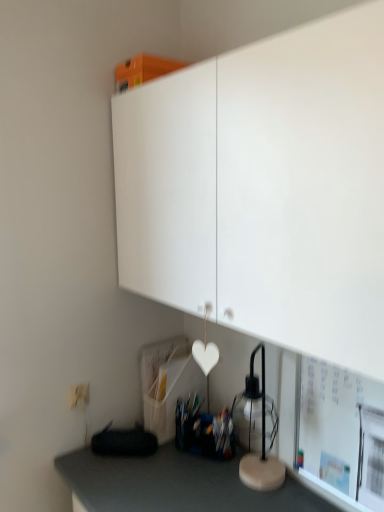
From the picture: Measure the distance between point (280, 469) and camera.

1.42 meters.

At what (x,y) coordinates should I click in order to perform the action: click on white matte cabinet at upper center. Please return your answer as a coordinate pair (x, y). Image resolution: width=384 pixels, height=512 pixels. Looking at the image, I should click on (264, 189).

This screenshot has height=512, width=384. What do you see at coordinates (330, 424) in the screenshot?
I see `white matte bulletin board at lower right` at bounding box center [330, 424].

The height and width of the screenshot is (512, 384). What do you see at coordinates (79, 395) in the screenshot?
I see `white matte electric outlet at lower left` at bounding box center [79, 395].

I want to click on transparent glass table lamp at lower right, so click(262, 450).

How distant is white matte bulletin board at lower right from white matte cabinet at upper center?

white matte bulletin board at lower right and white matte cabinet at upper center are 22.15 inches apart.

Can you confirm if white matte bulletin board at lower right is bigger than white matte cabinet at upper center?

No, white matte bulletin board at lower right is not bigger than white matte cabinet at upper center.

Is white matte bulletin board at lower right wider or thinner than white matte cabinet at upper center?

In the image, white matte bulletin board at lower right appears to be more narrow than white matte cabinet at upper center.

Find the location of `bulletin board behind the white matte cabinet at upper center`. bulletin board behind the white matte cabinet at upper center is located at coordinates (330, 424).

Based on the photo, from a real-world perspective, which object rests below the other?

white matte bulletin board at lower right is physically lower.

Between transparent glass table lamp at lower right and white matte bulletin board at lower right, which one has larger size?

white matte bulletin board at lower right is bigger.

This screenshot has height=512, width=384. Find the location of `bulletin board on the right of white matte electric outlet at lower left`. bulletin board on the right of white matte electric outlet at lower left is located at coordinates (330, 424).

Is white matte bulletin board at lower right facing away from white matte electric outlet at lower left?

No, white matte bulletin board at lower right is not facing the opposite direction of white matte electric outlet at lower left.

Between point (299, 450) and point (82, 395), which one is positioned behind?

The point (82, 395) is more distant.

Considering the sizes of objects white matte bulletin board at lower right and white matte electric outlet at lower left in the image provided, who is smaller, white matte bulletin board at lower right or white matte electric outlet at lower left?

Smaller between the two is white matte electric outlet at lower left.

Is transparent glass table lamp at lower right beside white matte electric outlet at lower left?

transparent glass table lamp at lower right is not next to white matte electric outlet at lower left, and they're not touching.

Considering the positions of point (263, 406) and point (75, 391), is point (263, 406) closer or farther from the camera than point (75, 391)?

Point (263, 406) is closer to the camera than point (75, 391).

Looking at this image, does transparent glass table lamp at lower right turn towards white matte electric outlet at lower left?

No.

Is point (261, 244) behind point (73, 404)?

No, it is not.

Is white matte cabinet at upper center touching white matte electric outlet at lower left?

white matte cabinet at upper center is not next to white matte electric outlet at lower left, and they're not touching.

From a real-world perspective, is white matte cabinet at upper center on white matte electric outlet at lower left?

Indeed, from a real-world perspective, white matte cabinet at upper center stands above white matte electric outlet at lower left.

Where is `electric outlet above the white matte bulletin board at lower right (from the image's perspective)`? electric outlet above the white matte bulletin board at lower right (from the image's perspective) is located at coordinates (79, 395).

Considering the sizes of white matte electric outlet at lower left and white matte bulletin board at lower right in the image, is white matte electric outlet at lower left taller or shorter than white matte bulletin board at lower right?

Considering their sizes, white matte electric outlet at lower left has less height than white matte bulletin board at lower right.

Can you tell me how much white matte electric outlet at lower left and white matte bulletin board at lower right differ in facing direction?

90.6 degrees separate the facing orientations of white matte electric outlet at lower left and white matte bulletin board at lower right.

Between white matte electric outlet at lower left and white matte bulletin board at lower right, which one appears on the left side from the viewer's perspective?

white matte electric outlet at lower left.

Which is more to the right, white matte electric outlet at lower left or white matte cabinet at upper center?

white matte cabinet at upper center.

How many degrees apart are the facing directions of white matte electric outlet at lower left and white matte cabinet at upper center?

89.7 degrees.

Is white matte electric outlet at lower left inside the boundaries of white matte cabinet at upper center, or outside?

white matte electric outlet at lower left is located beyond the bounds of white matte cabinet at upper center.

Who is bigger, white matte electric outlet at lower left or white matte cabinet at upper center?

white matte cabinet at upper center.

This screenshot has width=384, height=512. Find the location of `bulletin board that is under the white matte cabinet at upper center (from a real-world perspective)`. bulletin board that is under the white matte cabinet at upper center (from a real-world perspective) is located at coordinates (330, 424).

The height and width of the screenshot is (512, 384). In the image, there is a transparent glass table lamp at lower right. In order to click on bulletin board below it (from the image's perspective) in this screenshot , I will do `click(330, 424)`.

When comparing their distances from white matte bulletin board at lower right, does white matte electric outlet at lower left or transparent glass table lamp at lower right seem further?

Among the two, white matte electric outlet at lower left is located further to white matte bulletin board at lower right.

Which object lies nearer to the anchor point white matte bulletin board at lower right, transparent glass table lamp at lower right or white matte cabinet at upper center?

transparent glass table lamp at lower right.

Which object lies further to the anchor point transparent glass table lamp at lower right, white matte electric outlet at lower left or white matte cabinet at upper center?

white matte cabinet at upper center is positioned further to the anchor transparent glass table lamp at lower right.

From the image, which object appears to be farther from white matte cabinet at upper center, transparent glass table lamp at lower right or white matte electric outlet at lower left?

Based on the image, white matte electric outlet at lower left appears to be further to white matte cabinet at upper center.

When comparing their distances from white matte bulletin board at lower right, does transparent glass table lamp at lower right or white matte electric outlet at lower left seem further?

white matte electric outlet at lower left is further to white matte bulletin board at lower right.

When comparing their distances from white matte cabinet at upper center, does white matte electric outlet at lower left or white matte bulletin board at lower right seem closer?

Based on the image, white matte bulletin board at lower right appears to be nearer to white matte cabinet at upper center.

Looking at the image, which one is located closer to white matte electric outlet at lower left, white matte cabinet at upper center or transparent glass table lamp at lower right?

Among the two, transparent glass table lamp at lower right is located nearer to white matte electric outlet at lower left.

Which object lies nearer to the anchor point white matte cabinet at upper center, white matte bulletin board at lower right or transparent glass table lamp at lower right?

white matte bulletin board at lower right is closer to white matte cabinet at upper center.

The height and width of the screenshot is (512, 384). Find the location of `table lamp located between white matte electric outlet at lower left and white matte bulletin board at lower right in the left-right direction`. table lamp located between white matte electric outlet at lower left and white matte bulletin board at lower right in the left-right direction is located at coordinates (262, 450).

The image size is (384, 512). I want to click on bulletin board located between white matte cabinet at upper center and white matte electric outlet at lower left in the depth direction, so click(x=330, y=424).

Locate an element on the screen. The height and width of the screenshot is (512, 384). table lamp that lies between white matte cabinet at upper center and white matte bulletin board at lower right from top to bottom is located at coordinates (262, 450).

Find the location of a particular element. table lamp between white matte cabinet at upper center and white matte electric outlet at lower left in the front-back direction is located at coordinates (262, 450).